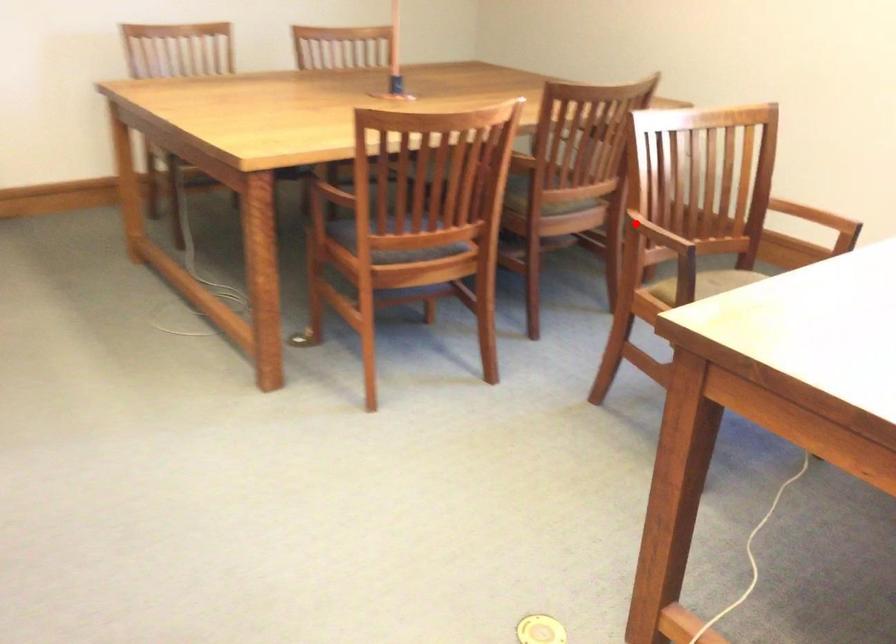
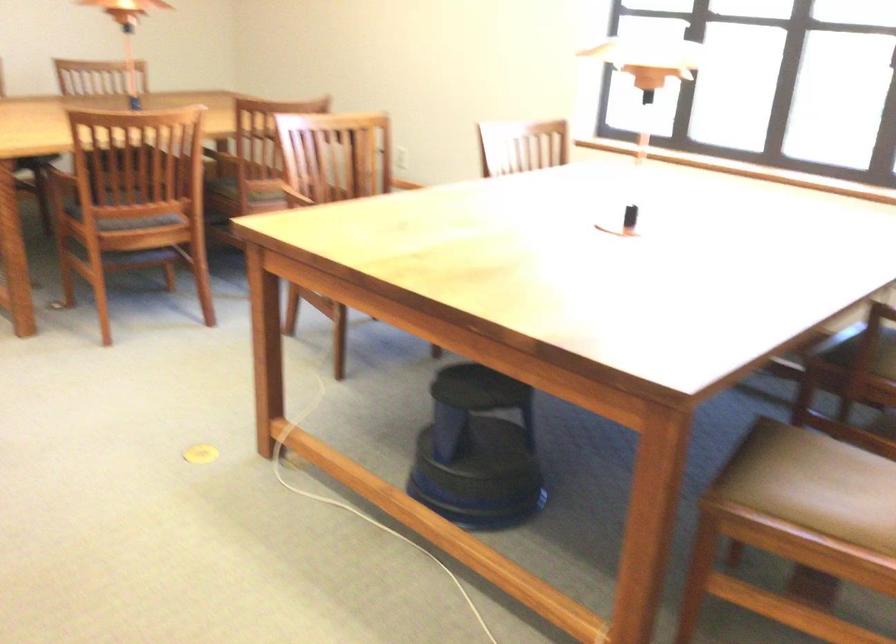
Question: I am providing you with two images of the same scene from different viewpoints. Image1 has a red point marked. In image2, the corresponding 3D location appears at what relative position? Reply with the corresponding letter.

Choices:
 (A) Closer
 (B) Farther

Answer: (B)